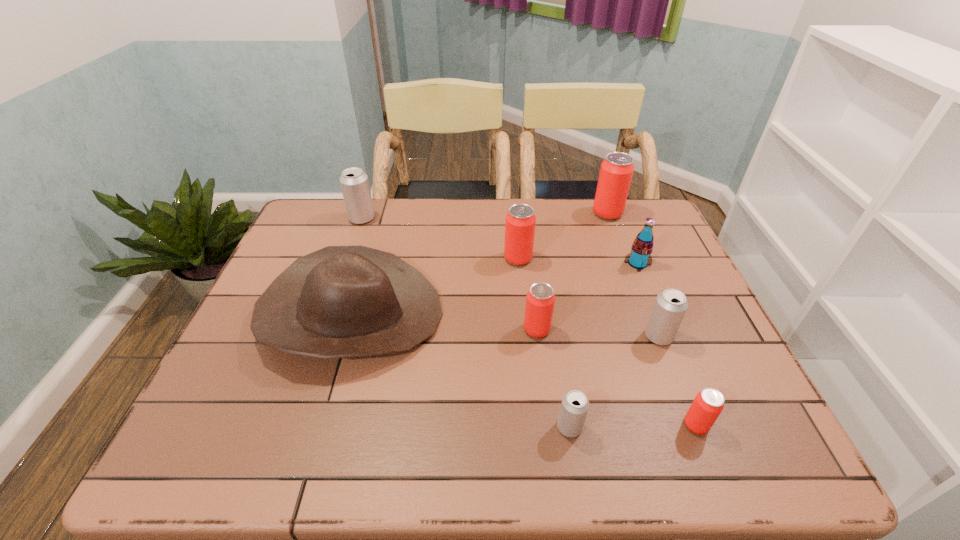
Where is `the biggest red beer can`? the biggest red beer can is located at coordinates (616, 171).

The image size is (960, 540). I want to click on the tallest beer can, so click(616, 171).

Identify the location of the second biggest red beer can. This screenshot has width=960, height=540. (520, 222).

In order to click on the third nearest red beer can in this screenshot , I will do `click(520, 222)`.

Where is `the biggest white beer can`? the biggest white beer can is located at coordinates coord(354,183).

The image size is (960, 540). I want to click on the leftmost white beer can, so click(x=354, y=183).

At what (x,y) coordinates should I click in order to perform the action: click on brown cowboy hat. Please return your answer as a coordinate pair (x, y). This screenshot has width=960, height=540. Looking at the image, I should click on (340, 301).

You are a GUI agent. You are given a task and a screenshot of the screen. Output one action in this format:
    pyautogui.click(x=<x>, y=<y>)
    Task: Click on the soda
    The image size is (960, 540).
    Given the screenshot: What is the action you would take?
    pyautogui.click(x=639, y=258)

What are the coordinates of `the rightmost white beer can` in the screenshot? It's located at (670, 306).

Locate an element on the screen. the second biggest white beer can is located at coordinates (670, 306).